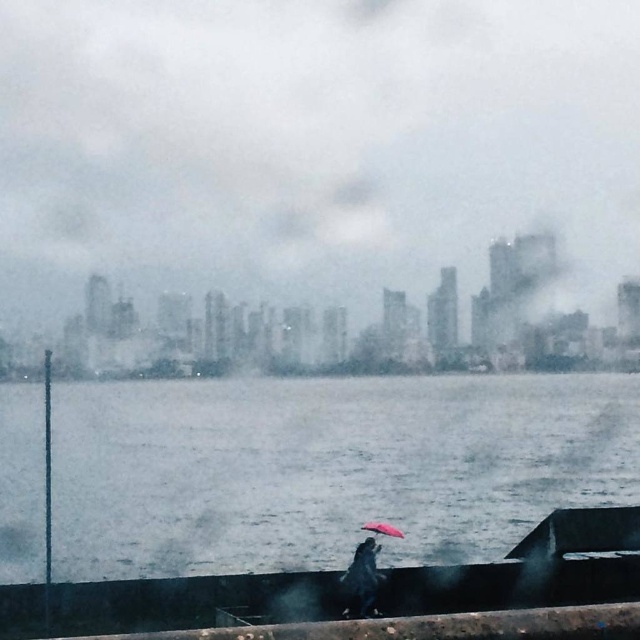
Is gray matte water at lower center further to the viewer compared to shiny black umbrella at lower center?

Yes, it is.

Can you confirm if gray matte water at lower center is smaller than shiny black umbrella at lower center?

No.

This screenshot has height=640, width=640. I want to click on gray matte water at lower center, so click(x=326, y=467).

The image size is (640, 640). What are the coordinates of `gray matte water at lower center` in the screenshot? It's located at (326, 467).

Between point (145, 445) and point (360, 529), which one is positioned behind?

Point (145, 445)

Is gray matte water at lower center thinner than matte pink umbrella at center?

No.

You are a GUI agent. You are given a task and a screenshot of the screen. Output one action in this format:
    pyautogui.click(x=<x>, y=<y>)
    Task: Click on the gray matte water at lower center
    
    Given the screenshot: What is the action you would take?
    pyautogui.click(x=326, y=467)

You are a GUI agent. You are given a task and a screenshot of the screen. Output one action in this format:
    pyautogui.click(x=<x>, y=<y>)
    Task: Click on the gray matte water at lower center
    This screenshot has height=640, width=640.
    Given the screenshot: What is the action you would take?
    pyautogui.click(x=326, y=467)

Does transparent glass skyscrapers at center appear on the left side of matte pink umbrella at center?

Correct, you'll find transparent glass skyscrapers at center to the left of matte pink umbrella at center.

Is transparent glass skyscrapers at center wider than matte pink umbrella at center?

Result: Correct, the width of transparent glass skyscrapers at center exceeds that of matte pink umbrella at center.

Does point (358, 316) lie behind point (365, 529)?

Yes, it is behind point (365, 529).

Identify the location of transparent glass skyscrapers at center. The height and width of the screenshot is (640, 640). (310, 145).